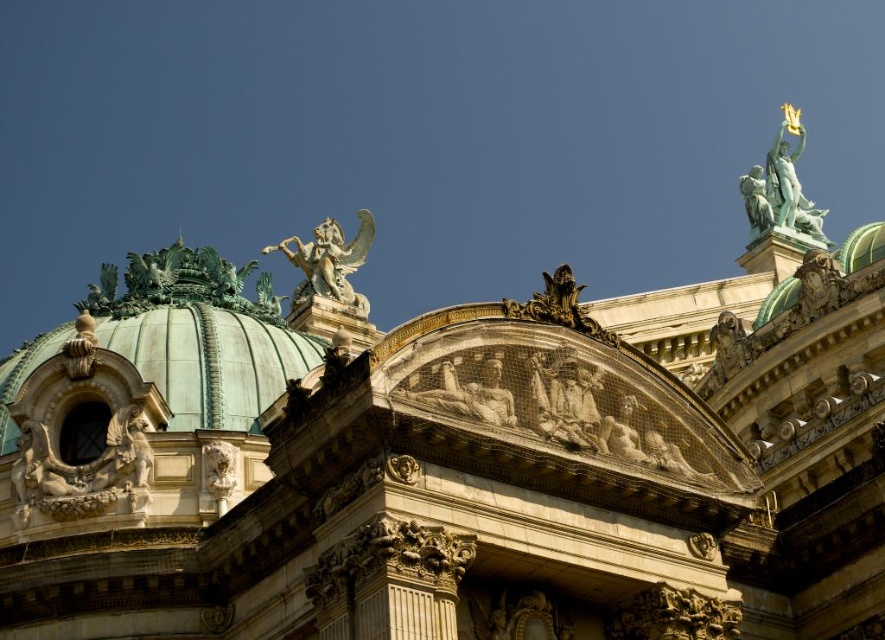
Looking at this image, you are standing in front of the grand historical building and want to take a photo that includes both the point at coordinates point (x=776, y=161) and the point at coordinates point (x=336, y=257). Based on their positions, which point should be placed closer to the camera in your composition to ensure both are visible?

Point (x=336, y=257) should be placed closer to the camera because it is in front of point (x=776, y=161), ensuring both are visible in the photo.

You are an architect examining the grand historical building. You notice the green stone winged creature at upper center. Where exactly is it located in the image?

The green stone winged creature at upper center is located at point (x=329, y=260) in the image.